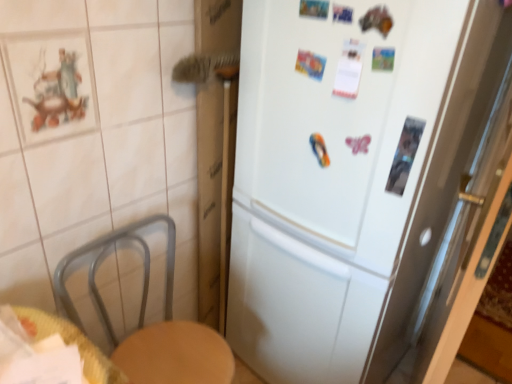
Question: Can you confirm if white matte refrigerator at center is taller than woven wood table at lower left?

Choices:
 (A) no
 (B) yes

Answer: (B)

Question: Is white matte refrigerator at center smaller than woven wood table at lower left?

Choices:
 (A) yes
 (B) no

Answer: (B)

Question: Is white matte refrigerator at center facing towards woven wood table at lower left?

Choices:
 (A) no
 (B) yes

Answer: (B)

Question: Is white matte refrigerator at center thinner than woven wood table at lower left?

Choices:
 (A) yes
 (B) no

Answer: (B)

Question: Does white matte refrigerator at center have a larger size compared to woven wood table at lower left?

Choices:
 (A) yes
 (B) no

Answer: (A)

Question: Considering the relative positions of white matte refrigerator at center and woven wood table at lower left in the image provided, is white matte refrigerator at center behind woven wood table at lower left?

Choices:
 (A) yes
 (B) no

Answer: (A)

Question: Is woven wood table at lower left thinner than white matte refrigerator at center?

Choices:
 (A) yes
 (B) no

Answer: (A)

Question: Is woven wood table at lower left closer to camera compared to white matte refrigerator at center?

Choices:
 (A) yes
 (B) no

Answer: (A)

Question: Is woven wood table at lower left wider than white matte refrigerator at center?

Choices:
 (A) no
 (B) yes

Answer: (A)

Question: Can you confirm if woven wood table at lower left is smaller than white matte refrigerator at center?

Choices:
 (A) no
 (B) yes

Answer: (B)

Question: Is woven wood table at lower left oriented towards white matte refrigerator at center?

Choices:
 (A) no
 (B) yes

Answer: (A)

Question: Does woven wood table at lower left come behind white matte refrigerator at center?

Choices:
 (A) no
 (B) yes

Answer: (A)

Question: From the image's perspective, is white matte refrigerator at center located above or below woven wood table at lower left?

Choices:
 (A) above
 (B) below

Answer: (A)